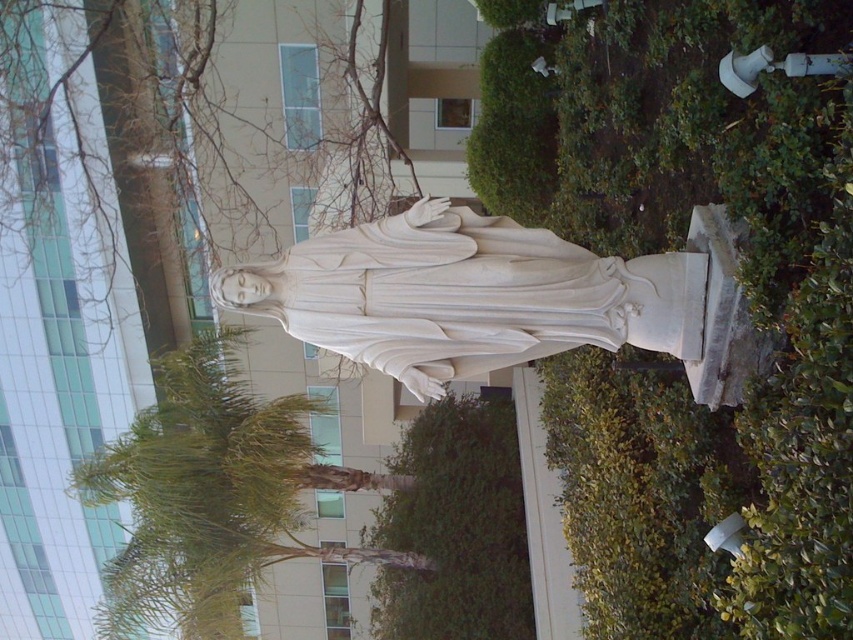
Question: Which of the following is the farthest from the observer?

Choices:
 (A) white marble statue at center
 (B) green leafy tree at center
 (C) bare branches at upper center

Answer: (C)

Question: Can you confirm if bare branches at upper center is positioned to the left of green leafy bush at lower center?

Choices:
 (A) no
 (B) yes

Answer: (B)

Question: Which is farther from the white marble statue at center?

Choices:
 (A) green leafy tree at center
 (B) bare branches at upper center

Answer: (B)

Question: Can you confirm if white marble statue at center is positioned to the left of green leafy bush at lower center?

Choices:
 (A) yes
 (B) no

Answer: (B)

Question: Is white marble statue at center bigger than green leafy tree at center?

Choices:
 (A) no
 (B) yes

Answer: (A)

Question: Which of the following is the closest to the observer?

Choices:
 (A) bare branches at upper center
 (B) green leafy bush at lower center

Answer: (B)